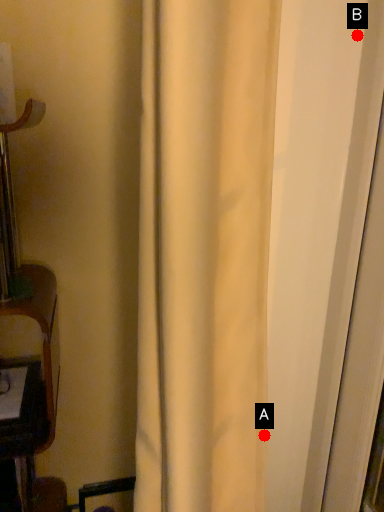
Question: Two points are circled on the image, labeled by A and B beside each circle. Which of the following is the closest to the observer?

Choices:
 (A) A is closer
 (B) B is closer

Answer: (B)